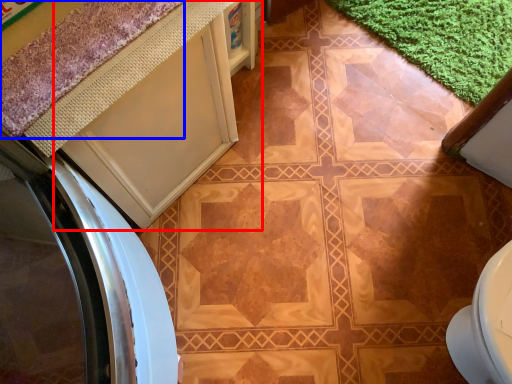
Question: Which point is closer to the camera, cabinetry (highlighted by a red box) or bath mat (highlighted by a blue box)?

Choices:
 (A) cabinetry
 (B) bath mat

Answer: (B)